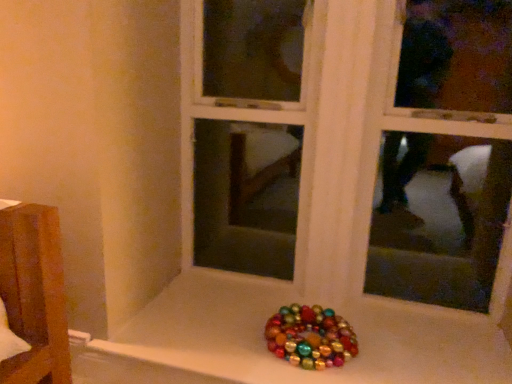
Question: From a real-world perspective, is metallic shiny ornaments at bottom above or below multicolored glossy beads at bottom center?

Choices:
 (A) above
 (B) below

Answer: (A)

Question: In the image, is metallic shiny ornaments at bottom positioned in front of or behind multicolored glossy beads at bottom center?

Choices:
 (A) front
 (B) behind

Answer: (A)

Question: From the image's perspective, is metallic shiny ornaments at bottom located above or below multicolored glossy beads at bottom center?

Choices:
 (A) above
 (B) below

Answer: (A)

Question: Looking at their shapes, would you say multicolored glossy beads at bottom center is wider or thinner than metallic shiny ornaments at bottom?

Choices:
 (A) wide
 (B) thin

Answer: (A)

Question: From a real-world perspective, is multicolored glossy beads at bottom center above or below metallic shiny ornaments at bottom?

Choices:
 (A) below
 (B) above

Answer: (A)

Question: Does point (316, 365) appear closer or farther from the camera than point (245, 183)?

Choices:
 (A) closer
 (B) farther

Answer: (A)

Question: In the image, is multicolored glossy beads at bottom center positioned in front of or behind metallic shiny ornaments at bottom?

Choices:
 (A) front
 (B) behind

Answer: (B)